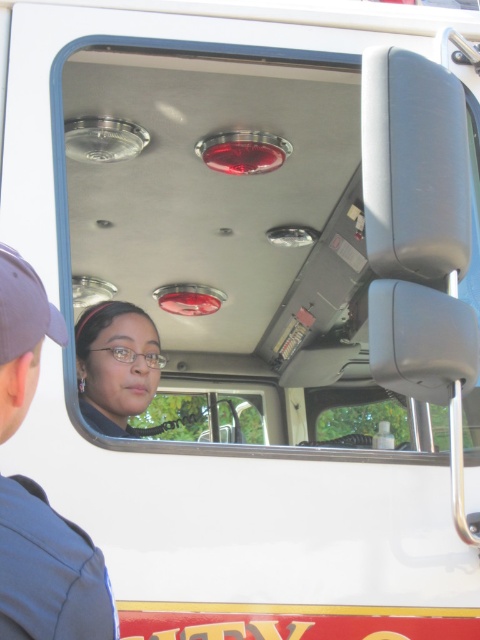
Which of these two, blue fabric cap at upper left or matte black glasses at center, stands shorter?

matte black glasses at center is shorter.

Which is below, blue fabric cap at upper left or matte black glasses at center?

Positioned lower is blue fabric cap at upper left.

Which is in front, point (39, 522) or point (110, 317)?

Point (39, 522) is more forward.

The width and height of the screenshot is (480, 640). What are the coordinates of `blue fabric cap at upper left` in the screenshot? It's located at (48, 572).